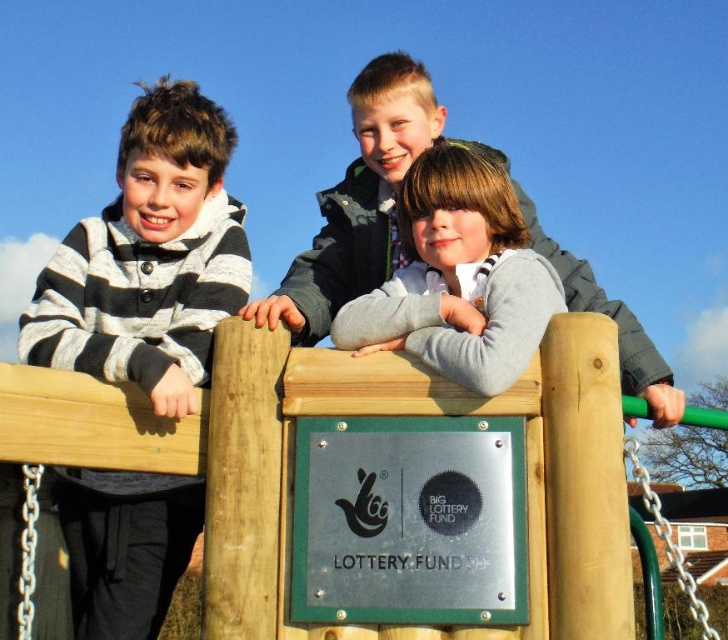
You are a photographer trying to capture the children in the image. If you want to focus on the gray matte sweater at center, where should you aim your camera based on the coordinates provided?

The gray matte sweater at center is located at coordinates point [458,276], so you should aim your camera at that specific point to focus on it.

You are a photographer trying to capture both the gray matte sweater at center and the gray fleece jacket at center in a single shot. Which clothing item should you adjust your camera angle to focus on first if you want to include both in the frame?

Since the gray matte sweater at center is to the right of the gray fleece jacket at center, you should adjust your camera angle to focus on the gray fleece jacket at center first to ensure both items are included in the frame.

You are a photographer trying to capture a photo of the striped knit sweater at left and the gray fleece jacket at center. Based on their positions, which clothing item is closer to the camera?

The striped knit sweater at left is positioned over the gray fleece jacket at center, meaning it is closer to the camera.